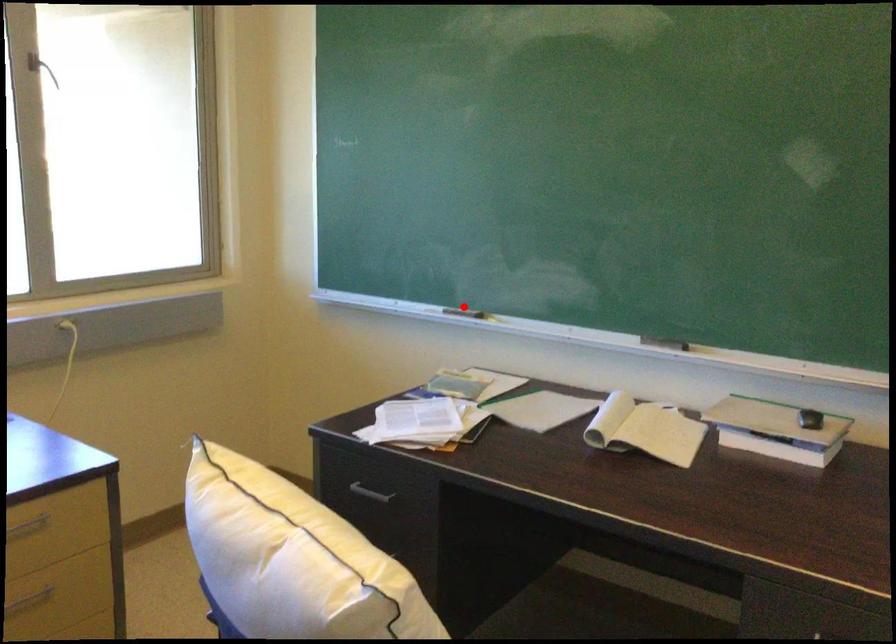
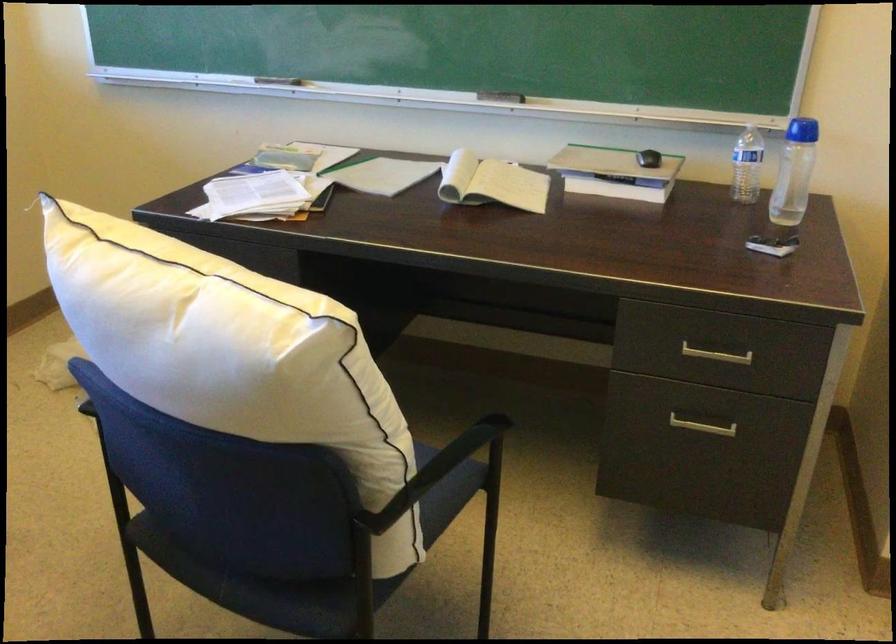
Locate, in the second image, the point that corresponds to the highlighted location in the first image.

(279, 80)